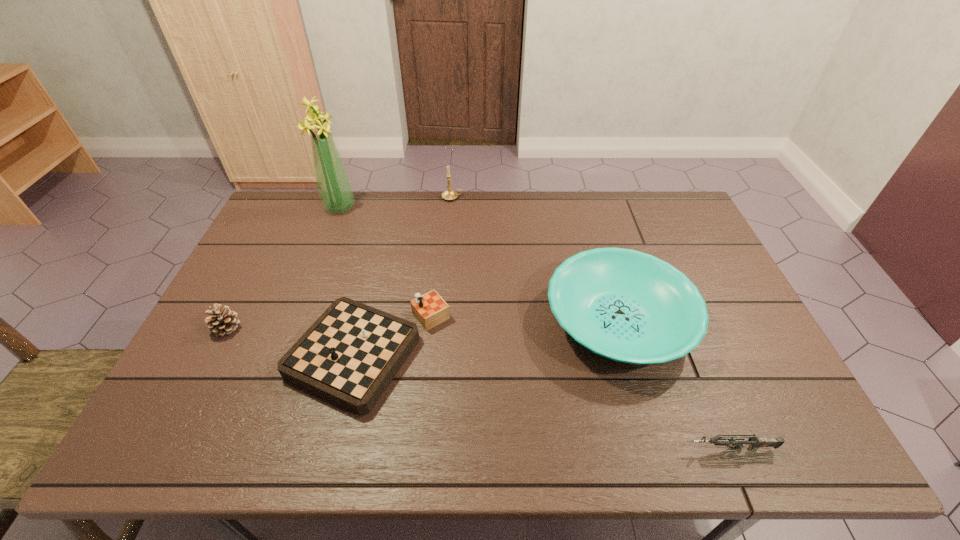
Identify the location of bouquet. (334, 187).

In order to click on candle holder in this screenshot , I will do `click(449, 194)`.

This screenshot has width=960, height=540. Identify the location of dish. (628, 306).

The image size is (960, 540). In order to click on pinecone in this screenshot , I will do `click(222, 321)`.

Locate an element on the screen. chessboard is located at coordinates (351, 353).

You are a GUI agent. You are given a task and a screenshot of the screen. Output one action in this format:
    pyautogui.click(x=<x>, y=<y>)
    Task: Click on the nearest object
    
    Given the screenshot: What is the action you would take?
    pyautogui.click(x=755, y=442)

At what (x,y) coordinates should I click in order to perform the action: click on gun. Please return your answer as a coordinate pair (x, y). Looking at the image, I should click on (755, 442).

Image resolution: width=960 pixels, height=540 pixels. In order to click on vacant space located 0.320m on the front-facing side of the tallest object in this screenshot , I will do `click(444, 207)`.

Where is `vacant region located 0.160m on the handle side of the candle holder`? The height and width of the screenshot is (540, 960). vacant region located 0.160m on the handle side of the candle holder is located at coordinates click(506, 198).

At what (x,y) coordinates should I click in order to perform the action: click on vacant space situated 0.220m on the back of the dish. Please return your answer as a coordinate pair (x, y). This screenshot has width=960, height=540. Looking at the image, I should click on (591, 226).